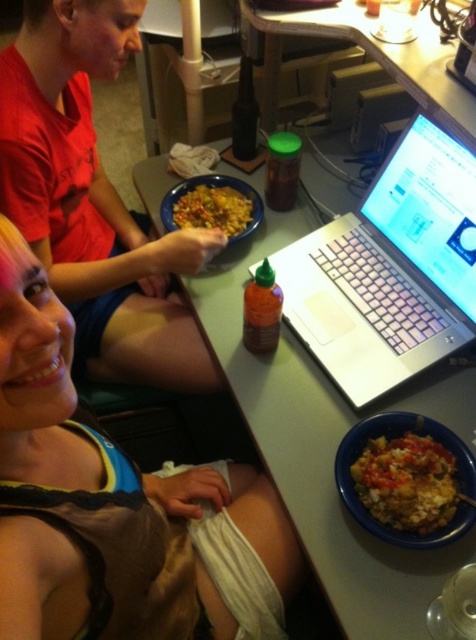
Question: Does silver metallic laptop at center appear under yellowish matte rice bowl at lower right?

Choices:
 (A) yes
 (B) no

Answer: (B)

Question: Which point is farther to the camera?

Choices:
 (A) matte brown tank top at lower left
 (B) yellowish matte rice bowl at lower right

Answer: (B)

Question: Which point is farther from the camera taking this photo?

Choices:
 (A) [158, 282]
 (B) [204, 186]

Answer: (A)

Question: Based on their relative distances, which object is nearer to the matte red shirt at upper left?

Choices:
 (A) green matte table at center
 (B) yellowish matte rice bowl at lower right
 (C) matte brown tank top at lower left

Answer: (A)

Question: Can you confirm if matte red shirt at upper left is thinner than green matte table at center?

Choices:
 (A) yes
 (B) no

Answer: (A)

Question: Does matte red shirt at upper left have a larger size compared to yellowish rice at center?

Choices:
 (A) no
 (B) yes

Answer: (B)